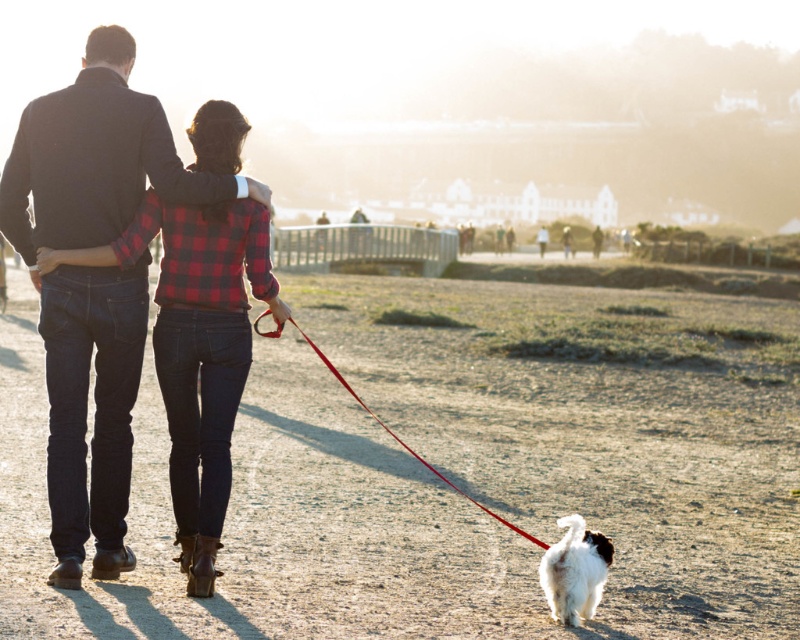
Which of these two, fluffy white dog at lower center or red nylon leash at lower center, stands shorter?

Standing shorter between the two is fluffy white dog at lower center.

Between fluffy white dog at lower center and red nylon leash at lower center, which one appears on the left side from the viewer's perspective?

Positioned to the left is red nylon leash at lower center.

Between point (578, 609) and point (421, 458), which one is positioned in front?

Point (578, 609) is in front.

Locate an element on the screen. The height and width of the screenshot is (640, 800). fluffy white dog at lower center is located at coordinates (574, 572).

Who is higher up, dark blue jeans at center or red nylon leash at lower center?

dark blue jeans at center is above.

Is dark blue jeans at center positioned before red nylon leash at lower center?

No, dark blue jeans at center is behind red nylon leash at lower center.

In order to click on dark blue jeans at center in this screenshot , I will do `click(94, 280)`.

Identify the location of dark blue jeans at center. (94, 280).

Can you confirm if dark blue jeans at center is bigger than fluffy white dog at lower center?

Yes, dark blue jeans at center is bigger than fluffy white dog at lower center.

Does dark blue jeans at center appear over fluffy white dog at lower center?

Indeed, dark blue jeans at center is positioned over fluffy white dog at lower center.

Is point (117, 508) more distant than point (570, 588)?

Yes, it is behind point (570, 588).

Where is `dark blue jeans at center`? dark blue jeans at center is located at coordinates 94,280.